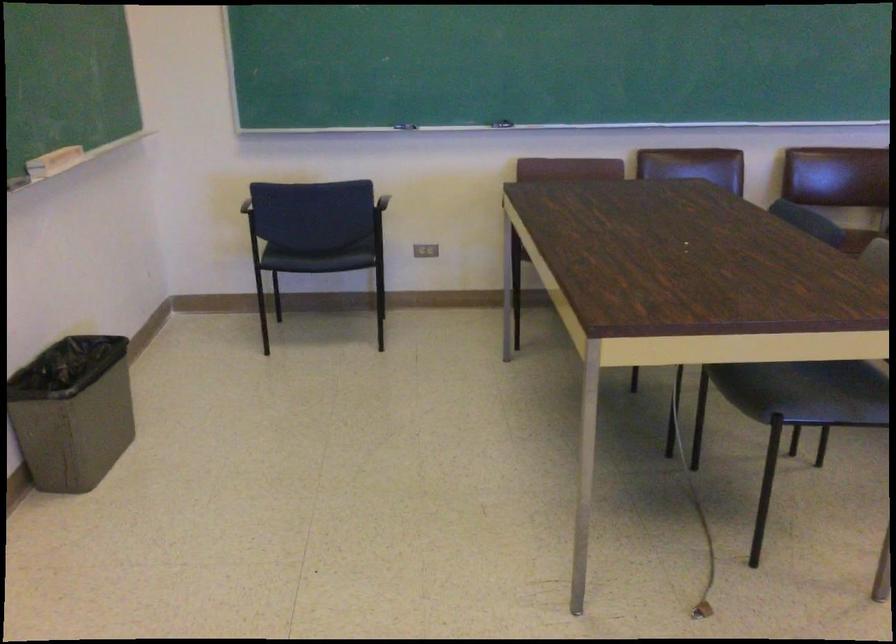
Image resolution: width=896 pixels, height=644 pixels. Find the location of `chalkboard eraser`. chalkboard eraser is located at coordinates (503, 124).